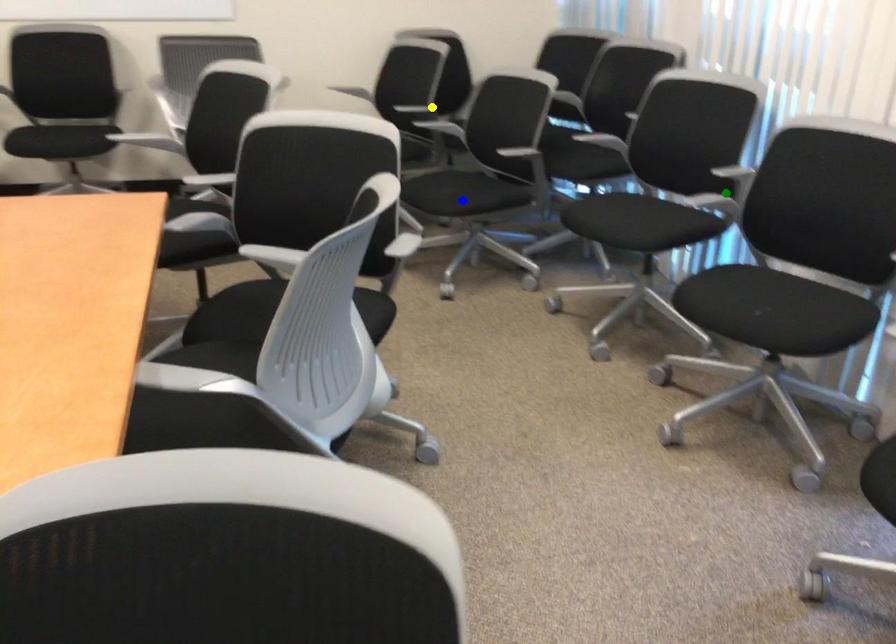
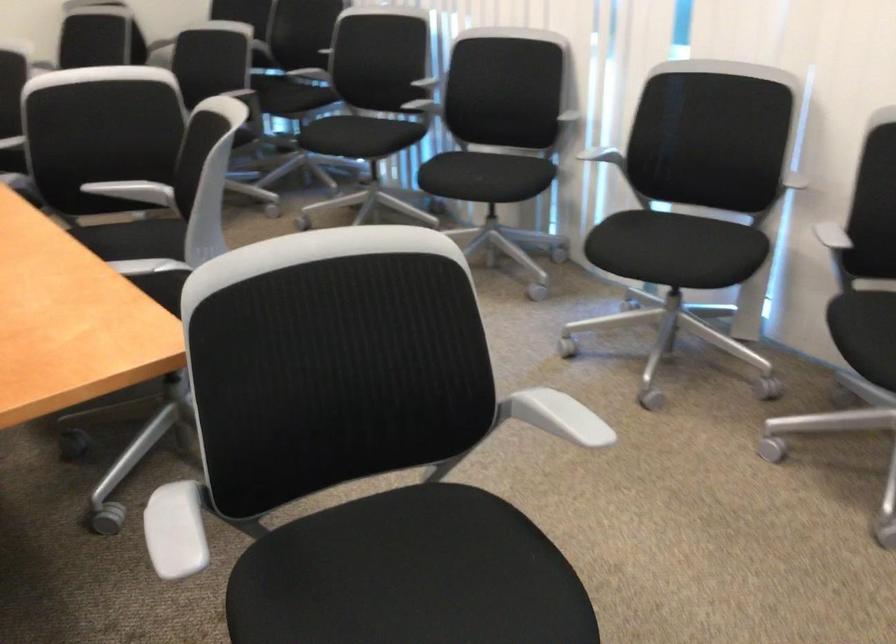
I am providing you with two images of the same scene from different viewpoints. Three points are marked in image1. Which point corresponds to a part or object that is occluded in image2?In image1, three points are marked. Which of them correspond to a part or object that is occluded in image2?Among the three points shown in image1, which one corresponds to a part or object that is no longer visible due to occlusion in image2?

blue point, green point, yellow point cannot be seen in image2.